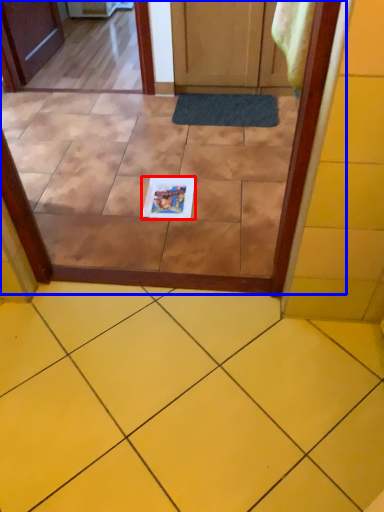
Question: Which point is closer to the camera, copy (highlighted by a red box) or glass door (highlighted by a blue box)?

Choices:
 (A) copy
 (B) glass door

Answer: (B)